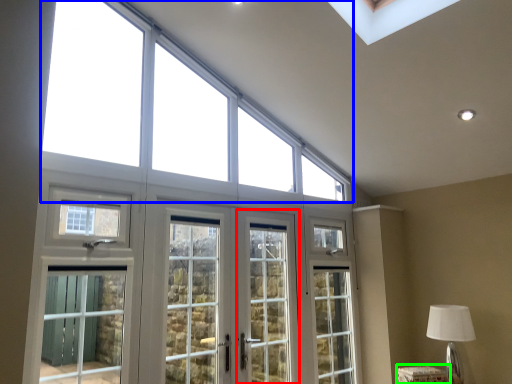
Question: Based on their relative distances, which object is farther from screen door (highlighted by a red box)? Choose from window (highlighted by a blue box) and furniture (highlighted by a green box).

Choices:
 (A) window
 (B) furniture

Answer: (B)